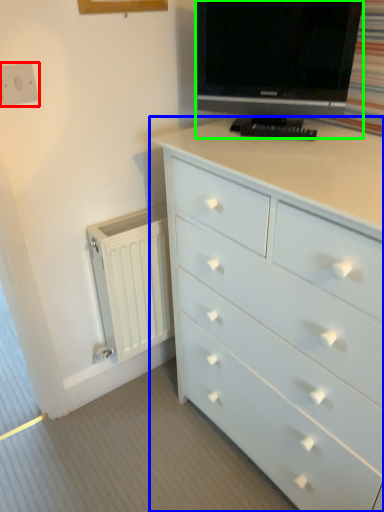
Question: Based on their relative distances, which object is farther from electric outlet (highlighted by a red box)? Choose from chest of drawers (highlighted by a blue box) and television (highlighted by a green box).

Choices:
 (A) chest of drawers
 (B) television

Answer: (A)